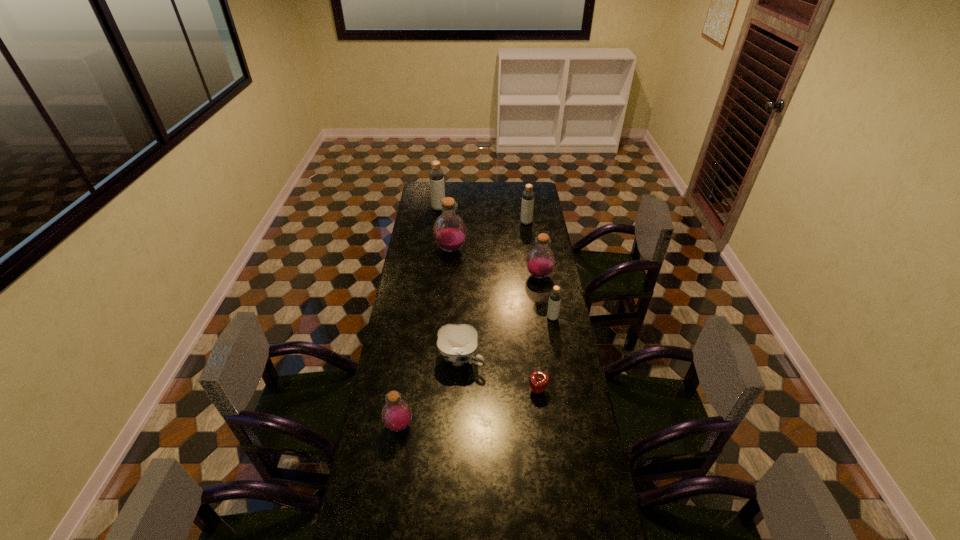
Identify the location of vacant region between the shortest object and the nearest object. (468, 408).

You are a GUI agent. You are given a task and a screenshot of the screen. Output one action in this format:
    pyautogui.click(x=<x>, y=<y>)
    Task: Click on the vacant space that's between the smallest purple bottle and the second biggest gray bottle
    The height and width of the screenshot is (540, 960).
    Given the screenshot: What is the action you would take?
    pyautogui.click(x=463, y=324)

Locate an element on the screen. The height and width of the screenshot is (540, 960). free area in between the seventh farthest object and the leftmost gray bottle is located at coordinates (489, 299).

Identify which object is located as the fourth nearest to the shortest object. Please provide its 2D coordinates. Your answer should be formatted as a tuple, i.e. [(x, y)], where the tuple contains the x and y coordinates of a point satisfying the conditions above.

[(540, 262)]

Where is `object that is the closest one to the second nearest bottle`? object that is the closest one to the second nearest bottle is located at coordinates (540, 262).

Identify the location of bottle identified as the fifth closest to the farthest purple bottle. Image resolution: width=960 pixels, height=540 pixels. (396, 414).

Select which bottle is the third closest to the sixth nearest object. Please provide its 2D coordinates. Your answer should be formatted as a tuple, i.e. [(x, y)], where the tuple contains the x and y coordinates of a point satisfying the conditions above.

[(527, 205)]

This screenshot has width=960, height=540. In order to click on gray bottle that stands as the second closest to the biggest purple bottle in this screenshot , I will do `click(527, 205)`.

Point out which gray bottle is positioned as the third nearest to the third farthest bottle. Please provide its 2D coordinates. Your answer should be formatted as a tuple, i.e. [(x, y)], where the tuple contains the x and y coordinates of a point satisfying the conditions above.

[(555, 295)]

Find the location of a particular element. purple bottle that is the third closest one to the second shortest object is located at coordinates (x=449, y=231).